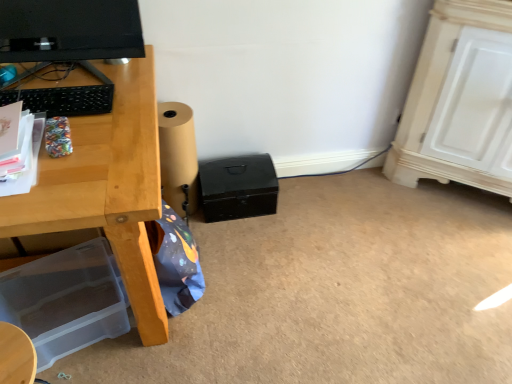
This screenshot has height=384, width=512. Identify the location of free spot in front of black matte box at center, the 1th box when ordered from back to front. (241, 249).